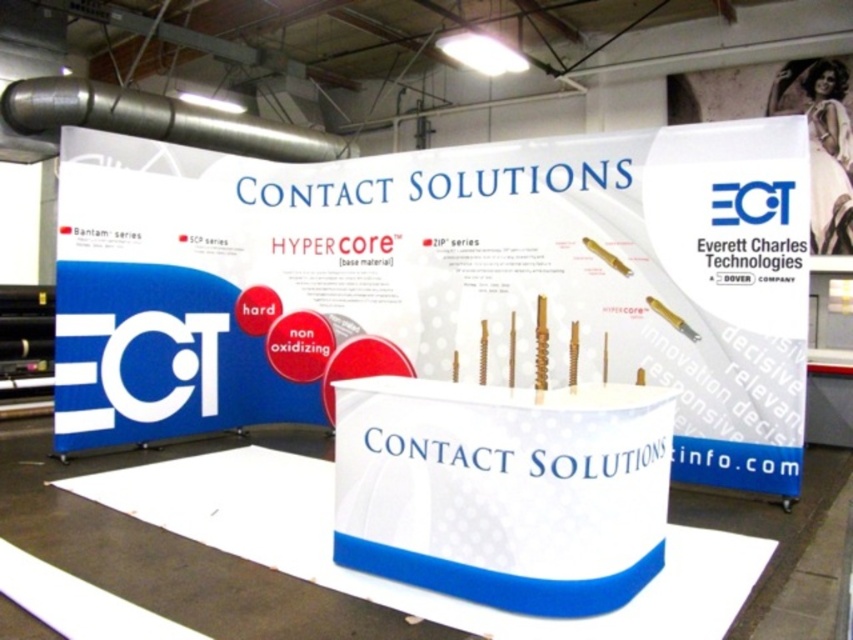
You are a visitor at the trade show and want to take a photo of both the white matte poster at center and the white glossy poster at upper right. The camera you have can capture objects within a 20 feet range. Can you capture both posters in a single photo without moving your position?

The distance between the white matte poster at center and the white glossy poster at upper right is 18.10 feet, which is within the 20 feet range of your camera. Therefore, you can capture both posters in a single photo without moving your position.

You are a visitor at the Everett Charles Technologies booth. You notice two posters on the main banner. One is a white matte poster at center and the other is a white glossy poster at upper right. Which poster is closer to you?

The white matte poster at center is closer to you because it is in front of the white glossy poster at upper right.